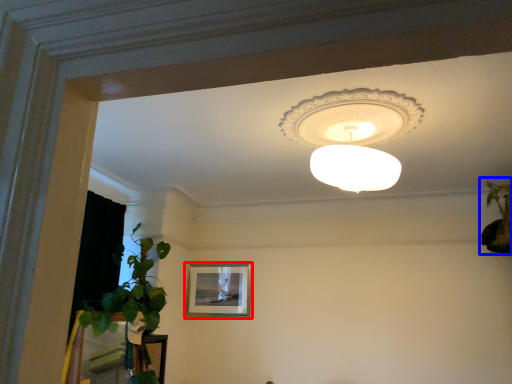
Question: Among these objects, which one is farthest to the camera, picture frame (highlighted by a red box) or houseplant (highlighted by a blue box)?

Choices:
 (A) picture frame
 (B) houseplant

Answer: (A)